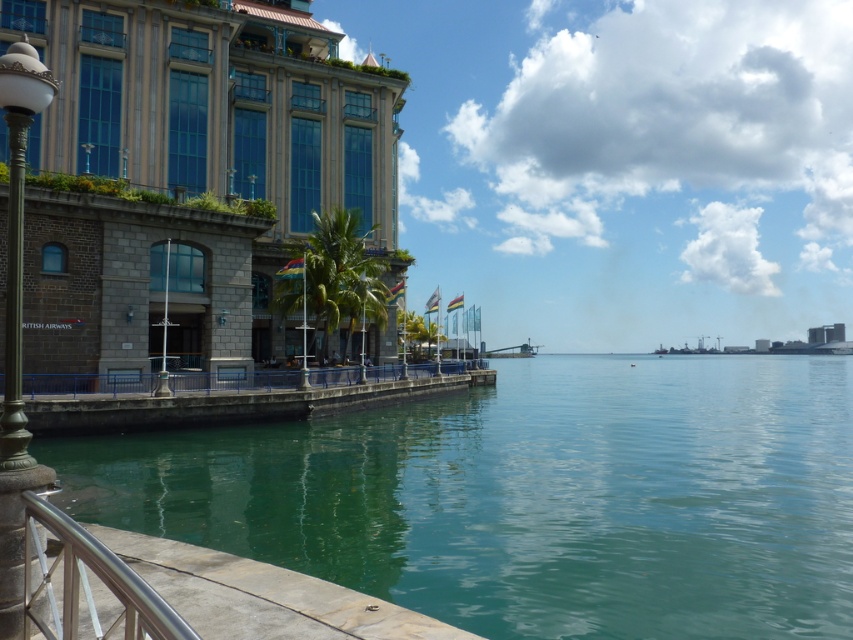
Question: Does green translucent water at center have a lesser width compared to satin silver railing at lower left?

Choices:
 (A) yes
 (B) no

Answer: (B)

Question: Is green translucent water at center bigger than bronze textured lamp post at left?

Choices:
 (A) yes
 (B) no

Answer: (A)

Question: Which point is farther to the camera?

Choices:
 (A) (154, 556)
 (B) (10, 216)
 (C) (659, 369)

Answer: (C)

Question: Does green translucent water at center have a greater width compared to bronze textured lamp post at left?

Choices:
 (A) yes
 (B) no

Answer: (A)

Question: Which is nearer to the green translucent water at center?

Choices:
 (A) satin silver railing at lower left
 (B) bronze textured lamp post at left

Answer: (A)

Question: Which object appears closest to the camera in this image?

Choices:
 (A) bronze textured lamp post at left
 (B) green translucent water at center

Answer: (A)